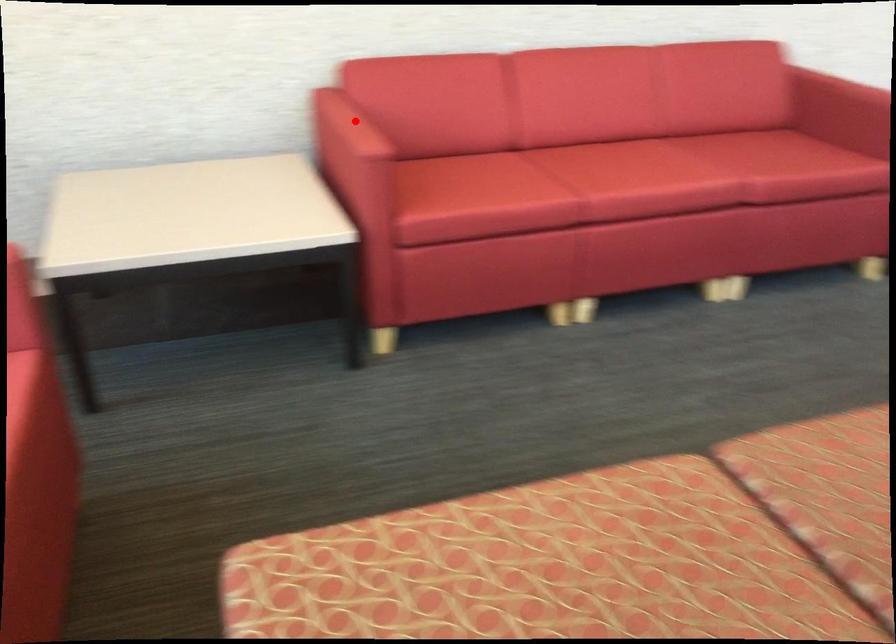
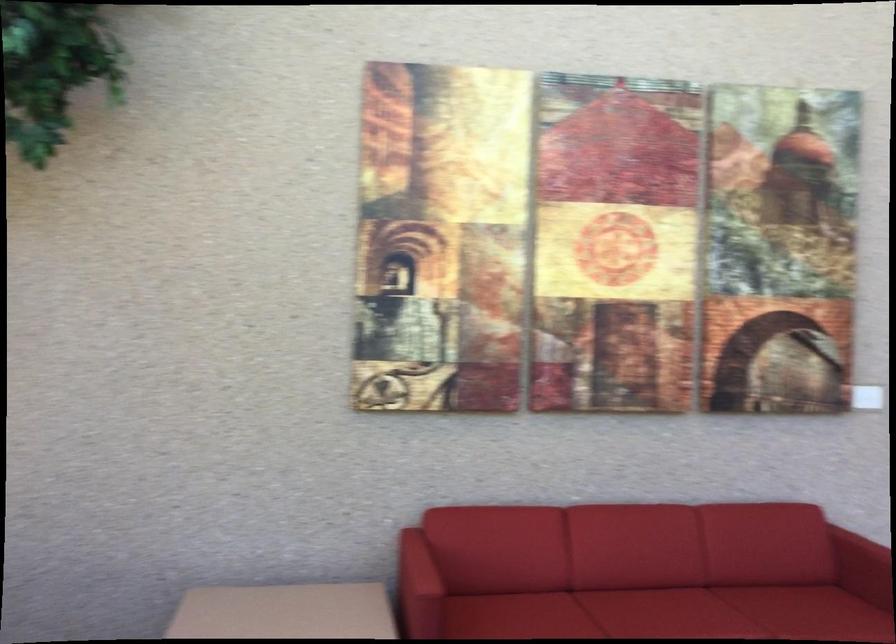
Find the pixel in the second image that matches the highlighted location in the first image.

(418, 564)